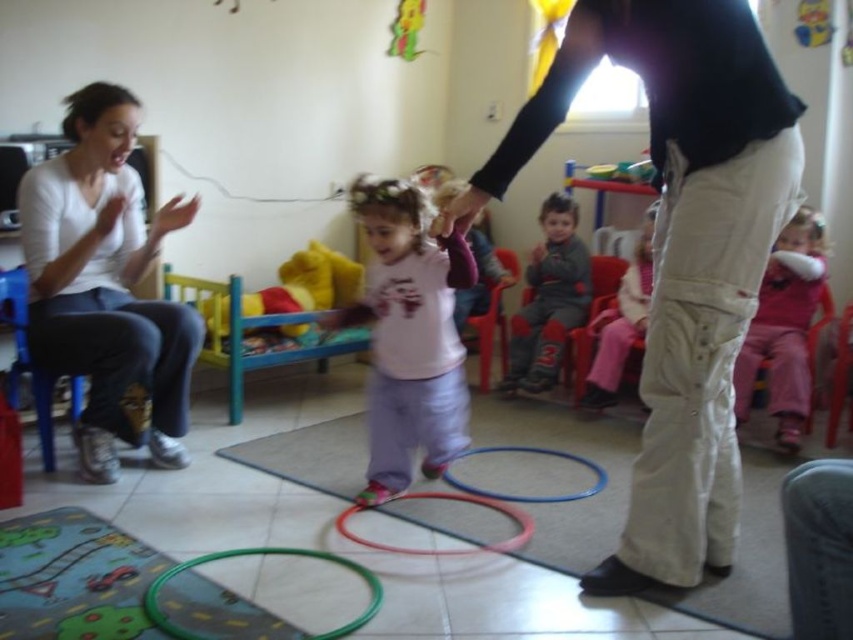
You are a parent trying to locate your child in a playroom. You see the white matte shirt at left and the translucent plastic hoop at center. Based on their positions, which object is closer to the entrance of the room?

The white matte shirt at left is closer to the entrance because it is positioned to the left of the translucent plastic hoop at center, which is further away from the entrance.

Looking at this image, you are a robot in the playroom and need to locate the khaki cotton pants at center. According to the coordinates provided, where exactly should you look to find them?

The khaki cotton pants at center are located at point 0.397 on the x axis and 0.798 on the y axis.